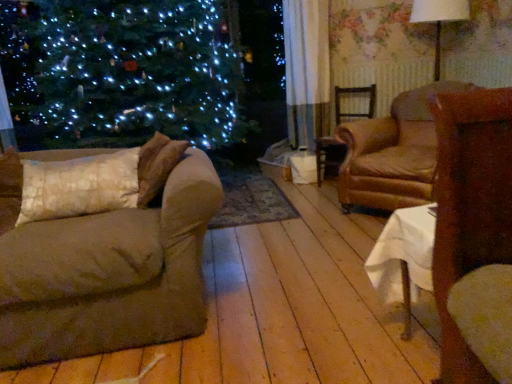
Question: From a real-world perspective, does white fabric lampshade at upper right stand above white textured pillow at left?

Choices:
 (A) yes
 (B) no

Answer: (A)

Question: Is white fabric lampshade at upper right at the left side of white textured pillow at left?

Choices:
 (A) no
 (B) yes

Answer: (A)

Question: From the image's perspective, is white fabric lampshade at upper right above white textured pillow at left?

Choices:
 (A) no
 (B) yes

Answer: (B)

Question: Does white fabric lampshade at upper right have a greater height compared to white textured pillow at left?

Choices:
 (A) no
 (B) yes

Answer: (B)

Question: Considering the relative sizes of white fabric lampshade at upper right and white textured pillow at left in the image provided, is white fabric lampshade at upper right smaller than white textured pillow at left?

Choices:
 (A) yes
 (B) no

Answer: (B)

Question: Can we say white fabric lampshade at upper right lies outside white textured pillow at left?

Choices:
 (A) yes
 (B) no

Answer: (A)

Question: Does white textured pillow at left lie in front of brown leather armchair at center-right, which ranks as the 2th chair in back-to-front order?

Choices:
 (A) no
 (B) yes

Answer: (B)

Question: Can you confirm if white textured pillow at left is positioned to the left of brown leather armchair at center-right, which is the 1th chair from front to back?

Choices:
 (A) no
 (B) yes

Answer: (B)

Question: Is white textured pillow at left far away from brown leather armchair at center-right, which ranks as the 2th chair in back-to-front order?

Choices:
 (A) yes
 (B) no

Answer: (A)

Question: Considering the relative sizes of white textured pillow at left and brown leather armchair at center-right, which ranks as the 2th chair in back-to-front order, in the image provided, is white textured pillow at left thinner than brown leather armchair at center-right, which ranks as the 2th chair in back-to-front order,?

Choices:
 (A) yes
 (B) no

Answer: (A)

Question: Does white textured pillow at left turn towards brown leather armchair at center-right, which ranks as the 2th chair in back-to-front order?

Choices:
 (A) yes
 (B) no

Answer: (B)

Question: Is white textured pillow at left located outside brown leather armchair at center-right, which is the 1th chair from front to back?

Choices:
 (A) yes
 (B) no

Answer: (A)

Question: Considering the relative sizes of brown fabric couch at left and brown wooden chair at center, positioned as the 2th chair in front-to-back order, in the image provided, is brown fabric couch at left shorter than brown wooden chair at center, positioned as the 2th chair in front-to-back order,?

Choices:
 (A) no
 (B) yes

Answer: (B)